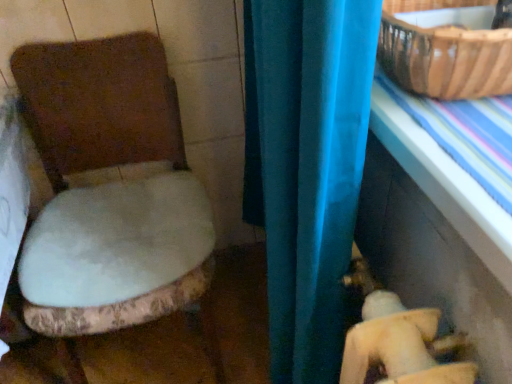
Question: From the image's perspective, is brown woven basket at upper right on top of white plush toilet seat at left?

Choices:
 (A) yes
 (B) no

Answer: (A)

Question: From a real-world perspective, is brown woven basket at upper right on white plush toilet seat at left?

Choices:
 (A) no
 (B) yes

Answer: (B)

Question: Is brown woven basket at upper right oriented towards white plush toilet seat at left?

Choices:
 (A) no
 (B) yes

Answer: (A)

Question: Considering the relative sizes of brown woven basket at upper right and white plush toilet seat at left in the image provided, is brown woven basket at upper right taller than white plush toilet seat at left?

Choices:
 (A) yes
 (B) no

Answer: (B)

Question: Is brown woven basket at upper right positioned with its back to white plush toilet seat at left?

Choices:
 (A) no
 (B) yes

Answer: (A)

Question: Is brown woven basket at upper right located outside white plush toilet seat at left?

Choices:
 (A) no
 (B) yes

Answer: (B)

Question: Is blue plastic table at right located outside white plush toilet seat at left?

Choices:
 (A) yes
 (B) no

Answer: (A)

Question: Is blue plastic table at right to the right of white plush toilet seat at left from the viewer's perspective?

Choices:
 (A) yes
 (B) no

Answer: (A)

Question: Is blue plastic table at right far from white plush toilet seat at left?

Choices:
 (A) yes
 (B) no

Answer: (B)

Question: From a real-world perspective, is blue plastic table at right under white plush toilet seat at left?

Choices:
 (A) no
 (B) yes

Answer: (A)

Question: Can you confirm if blue plastic table at right is bigger than white plush toilet seat at left?

Choices:
 (A) no
 (B) yes

Answer: (A)

Question: Does blue plastic table at right have a greater width compared to white plush toilet seat at left?

Choices:
 (A) yes
 (B) no

Answer: (B)

Question: Can you confirm if brown woven basket at upper right is bigger than blue plastic table at right?

Choices:
 (A) yes
 (B) no

Answer: (B)